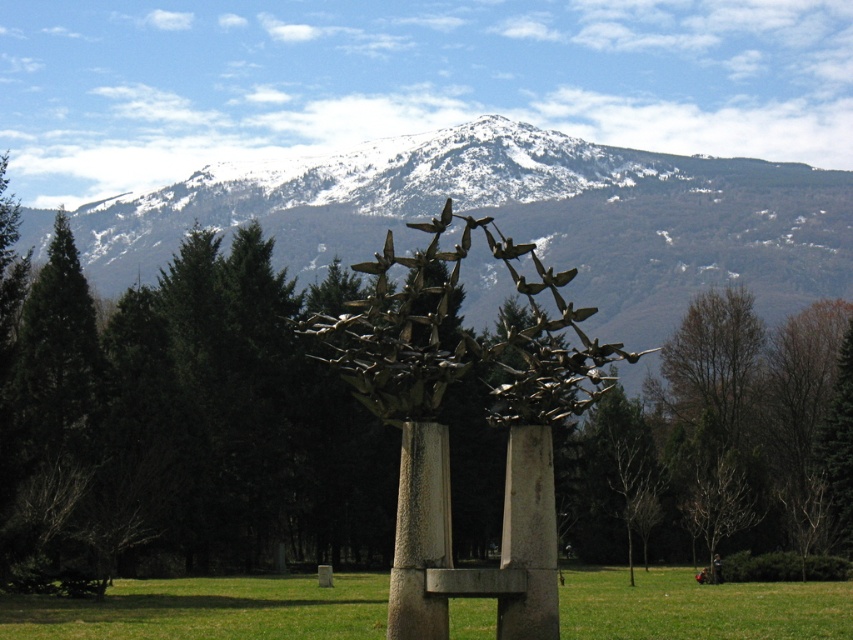
Question: Which object is farther from the camera taking this photo?

Choices:
 (A) metallic sculpture at center
 (B) polished bronze birds at center
 (C) rusty metal pole at center

Answer: (A)

Question: Which point is farther from the camera taking this photo?

Choices:
 (A) (473, 593)
 (B) (440, 547)
 (C) (480, 372)

Answer: (C)

Question: Does metallic sculpture at center have a larger size compared to polished bronze birds at center?

Choices:
 (A) no
 (B) yes

Answer: (B)

Question: Where is metallic sculpture at center located in relation to rusty metal pole at center in the image?

Choices:
 (A) above
 (B) below

Answer: (A)

Question: Can you confirm if polished bronze birds at center is positioned to the right of rusty metal pole at center?

Choices:
 (A) no
 (B) yes

Answer: (B)

Question: Which point appears farthest from the camera in this image?

Choices:
 (A) (549, 528)
 (B) (375, 554)

Answer: (B)